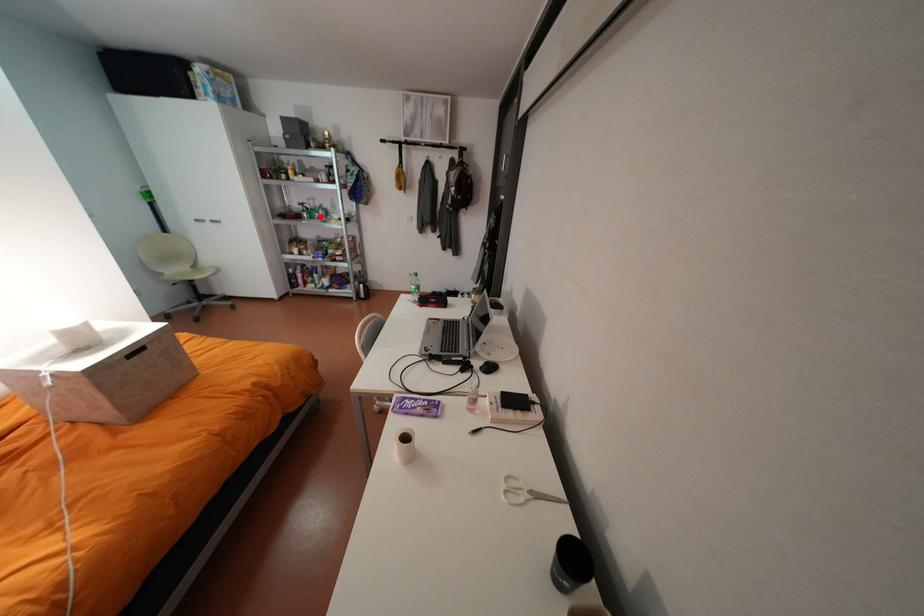
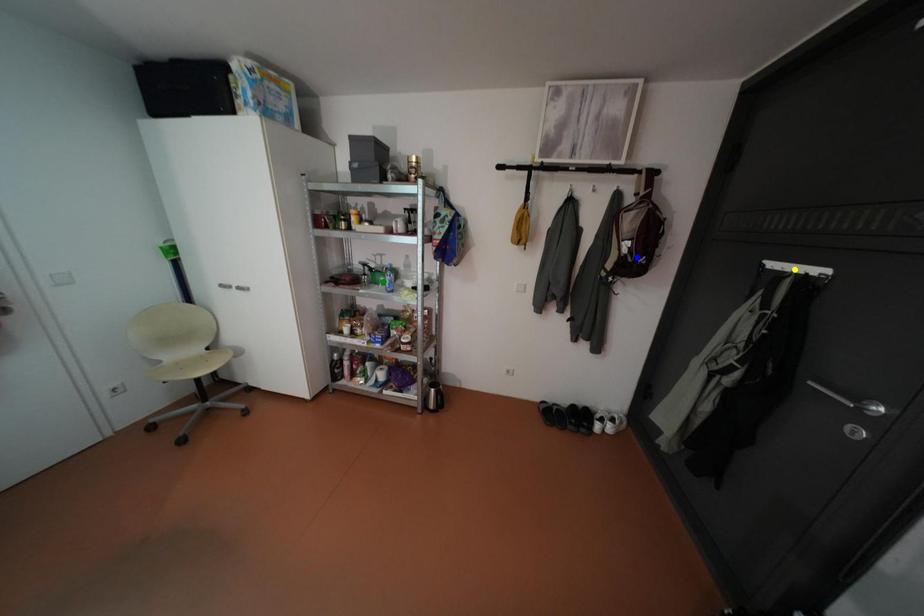
Question: I am providing you with two images of the same scene from different viewpoints. A red point is marked on the first image. You are given multiple points on the second image. Which point in image 2 represents the same 3d spot as the red point in image 1?

Choices:
 (A) yellow point
 (B) green point
 (C) blue point

Answer: (B)